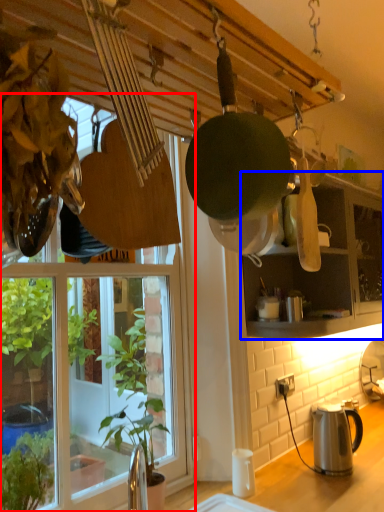
Question: Which point is closer to the camera, window (highlighted by a red box) or cabinetry (highlighted by a blue box)?

Choices:
 (A) window
 (B) cabinetry

Answer: (A)